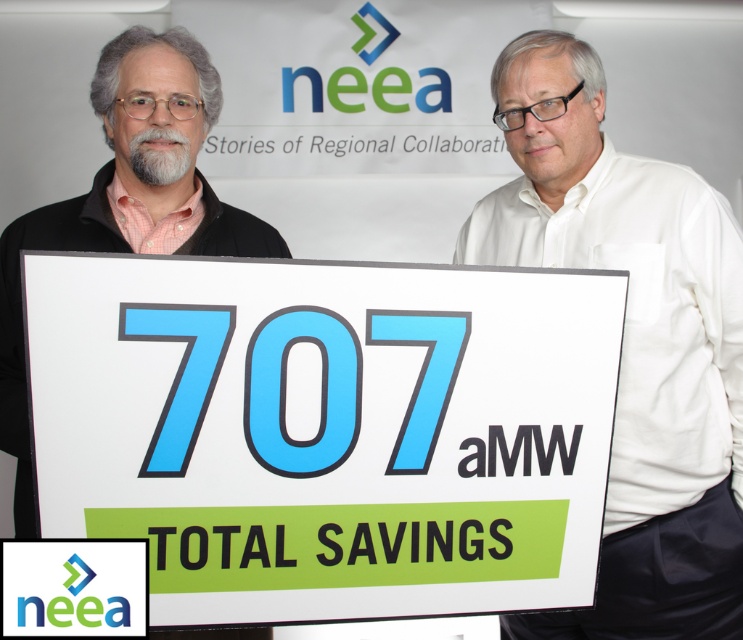
Is point (733, 376) positioned behind point (103, 77)?

No, it is in front of (103, 77).

Who is more distant from viewer, (739, 406) or (166, 38)?

The point (166, 38) is more distant.

In order to click on white shirt at center in this screenshot , I will do `click(632, 340)`.

Is point (567, 369) closer to camera compared to point (142, 132)?

Yes.

Can you confirm if white paper sign at center is positioned below matte black shirt at left?

Correct, white paper sign at center is located below matte black shirt at left.

Find the location of a particular element. white paper sign at center is located at coordinates (325, 429).

How distant is white paper sign at center from white shirt at center?

16.69 inches

You are a GUI agent. You are given a task and a screenshot of the screen. Output one action in this format:
    pyautogui.click(x=<x>, y=<y>)
    Task: Click on the white paper sign at center
    
    Given the screenshot: What is the action you would take?
    pyautogui.click(x=325, y=429)